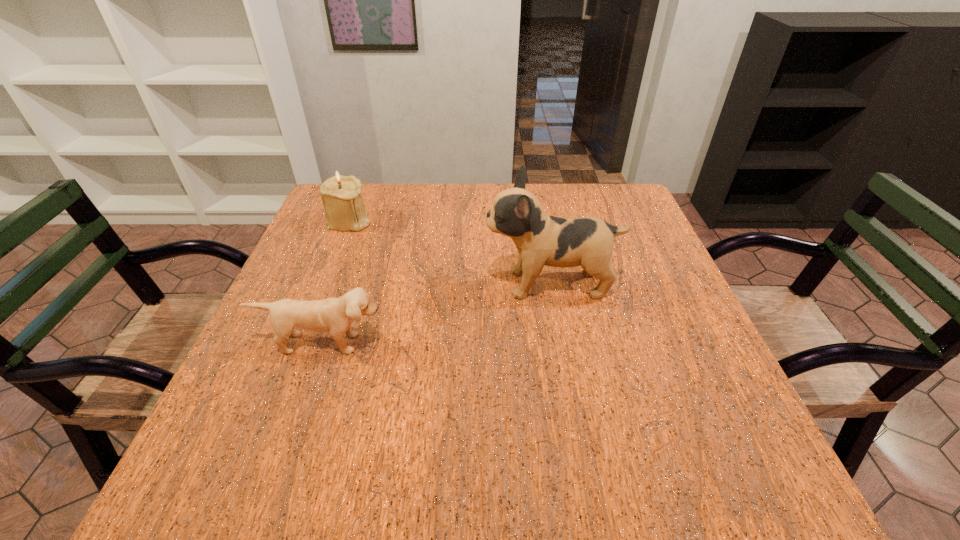
Locate an element on the screen. the farther puppy is located at coordinates (540, 239).

The image size is (960, 540). Find the location of `the tallest object`. the tallest object is located at coordinates (540, 239).

The image size is (960, 540). I want to click on the farthest object, so click(x=341, y=195).

Where is `the shorter puppy`? The width and height of the screenshot is (960, 540). the shorter puppy is located at coordinates (336, 315).

Identify the location of the shortest object. This screenshot has width=960, height=540. (336, 315).

What are the coordinates of `vacant space located 0.380m at the face of the rightmost object` in the screenshot? It's located at (319, 285).

You are a GUI agent. You are given a task and a screenshot of the screen. Output one action in this format:
    pyautogui.click(x=<x>, y=<y>)
    Task: Click on the free space located 0.230m at the face of the rightmost object
    This screenshot has width=960, height=540.
    Given the screenshot: What is the action you would take?
    pyautogui.click(x=384, y=285)

The width and height of the screenshot is (960, 540). Find the location of `blank space located 0.380m at the face of the rightmost object`. blank space located 0.380m at the face of the rightmost object is located at coordinates (319, 285).

The height and width of the screenshot is (540, 960). I want to click on vacant point located on the right of the candle_holder, so click(423, 220).

Where is `vacant space situated 0.080m on the left side of the shortest object`? The width and height of the screenshot is (960, 540). vacant space situated 0.080m on the left side of the shortest object is located at coordinates (305, 393).